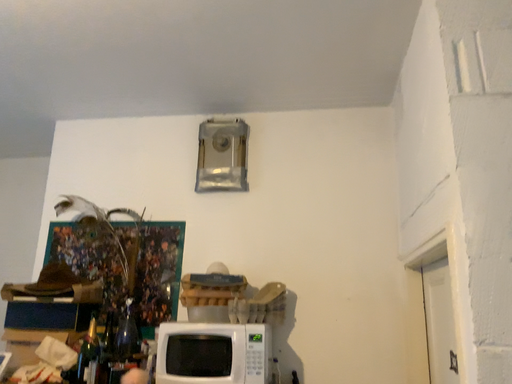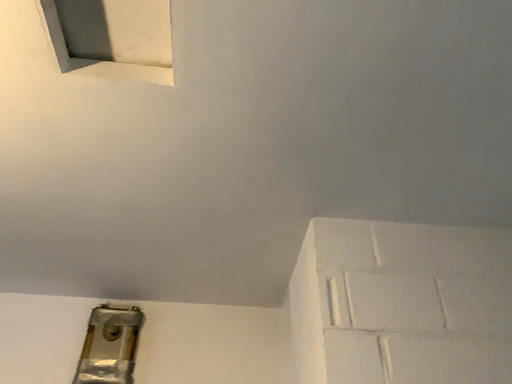
Question: Which way did the camera rotate in the video?

Choices:
 (A) rotated right
 (B) rotated left

Answer: (A)